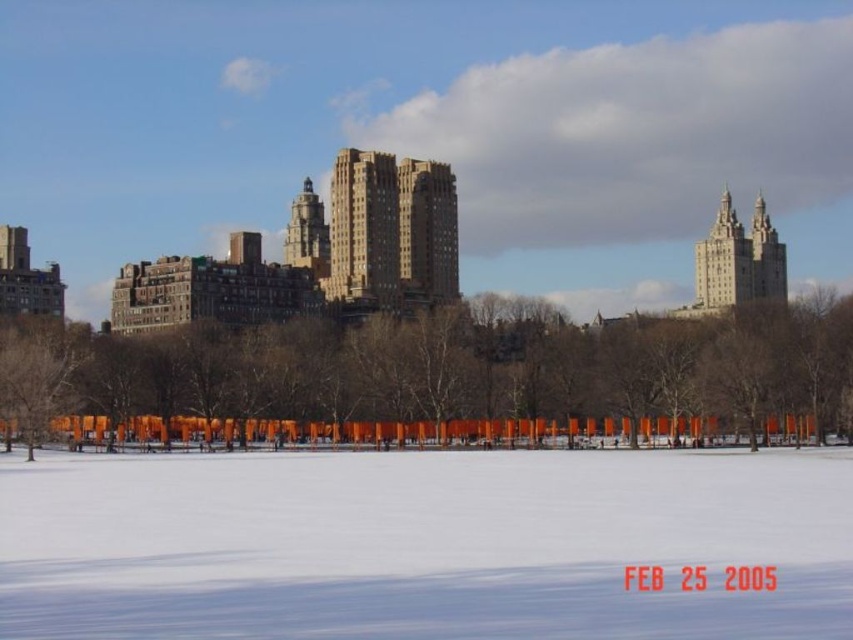
Question: Which point appears farthest from the camera in this image?

Choices:
 (A) (714, 284)
 (B) (306, 196)
 (C) (416, 337)

Answer: (B)

Question: Considering the relative positions of white powdery snow at center and orange fabric trees at center in the image provided, where is white powdery snow at center located with respect to orange fabric trees at center?

Choices:
 (A) above
 (B) below

Answer: (B)

Question: Can you confirm if matte gray building at upper right is positioned to the right of matte brown building at center?

Choices:
 (A) no
 (B) yes

Answer: (B)

Question: Which point is closer to the camera?

Choices:
 (A) (49, 518)
 (B) (750, 282)
 (C) (334, 298)
 (D) (314, 275)

Answer: (A)

Question: Does orange fabric trees at center have a larger size compared to matte gray building at upper right?

Choices:
 (A) yes
 (B) no

Answer: (A)

Question: Among these objects, which one is farthest from the camera?

Choices:
 (A) orange fabric trees at center
 (B) matte brown building at center
 (C) brown stone building at center

Answer: (B)